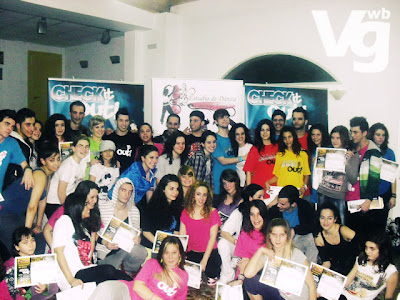
At what (x,y) coordinates should I click in order to perform the action: click on posters. Please return your answer as a coordinate pair (x, y). The height and width of the screenshot is (300, 400). Looking at the image, I should click on (125, 89), (189, 84), (273, 96).